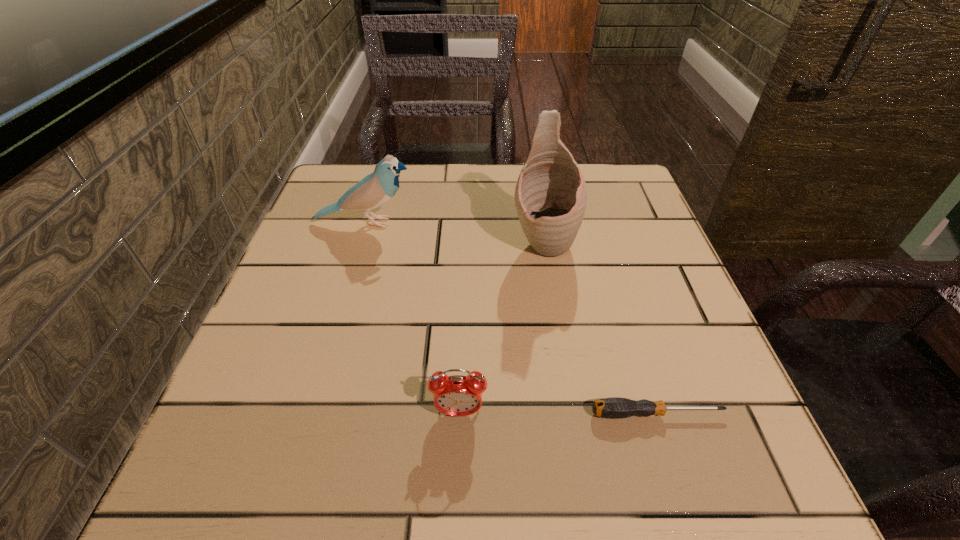
In the image, there is a desktop. At what (x,y) coordinates should I click in order to perform the action: click on vacant space at the near right corner. Please return your answer as a coordinate pair (x, y). Looking at the image, I should click on (676, 501).

At what (x,y) coordinates should I click in order to perform the action: click on unoccupied area between the third shortest object and the second object from left to right. Please return your answer as a coordinate pair (x, y). The width and height of the screenshot is (960, 540). Looking at the image, I should click on (413, 318).

Locate an element on the screen. This screenshot has width=960, height=540. unoccupied area between the tallest object and the alarm clock is located at coordinates (501, 328).

Image resolution: width=960 pixels, height=540 pixels. I want to click on vacant area between the third shortest object and the pitcher, so click(455, 233).

This screenshot has height=540, width=960. What are the coordinates of `unoccupied position between the shortest object and the bird` in the screenshot? It's located at (512, 318).

At what (x,y) coordinates should I click in order to perform the action: click on empty location between the second tallest object and the shortest object. Please return your answer as a coordinate pair (x, y). Looking at the image, I should click on coord(512,318).

You are a GUI agent. You are given a task and a screenshot of the screen. Output one action in this format:
    pyautogui.click(x=<x>, y=<y>)
    Task: Click on the free spot between the pitcher and the shortest object
    The image size is (960, 540).
    Given the screenshot: What is the action you would take?
    pyautogui.click(x=600, y=328)

What are the coordinates of `unoccupied area between the leftmost object and the alarm clock` in the screenshot? It's located at (413, 318).

The width and height of the screenshot is (960, 540). Identify the location of empty location between the screwdriver and the tallest object. (600, 328).

Locate an element on the screen. vacant area that lies between the third object from right to left and the leftmost object is located at coordinates coord(413,318).